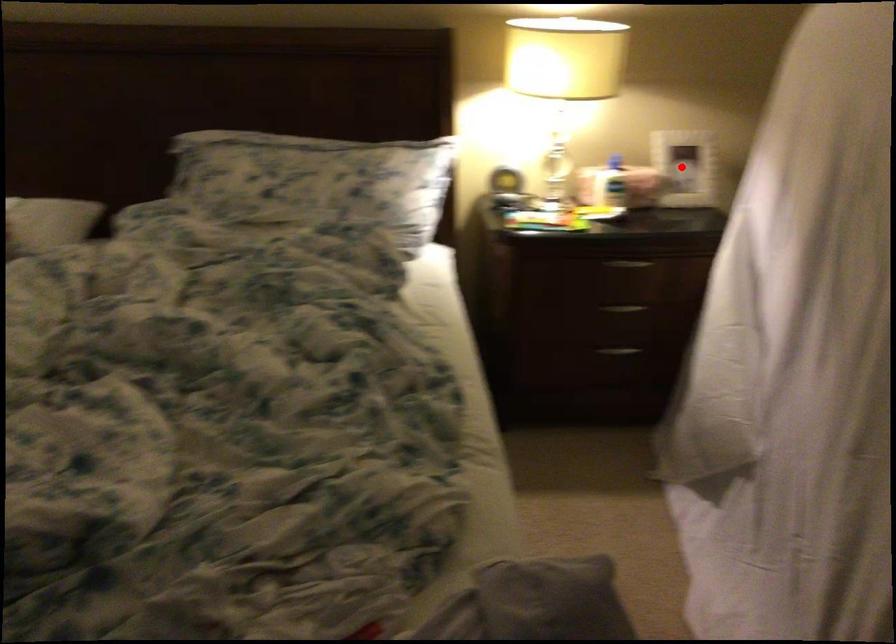
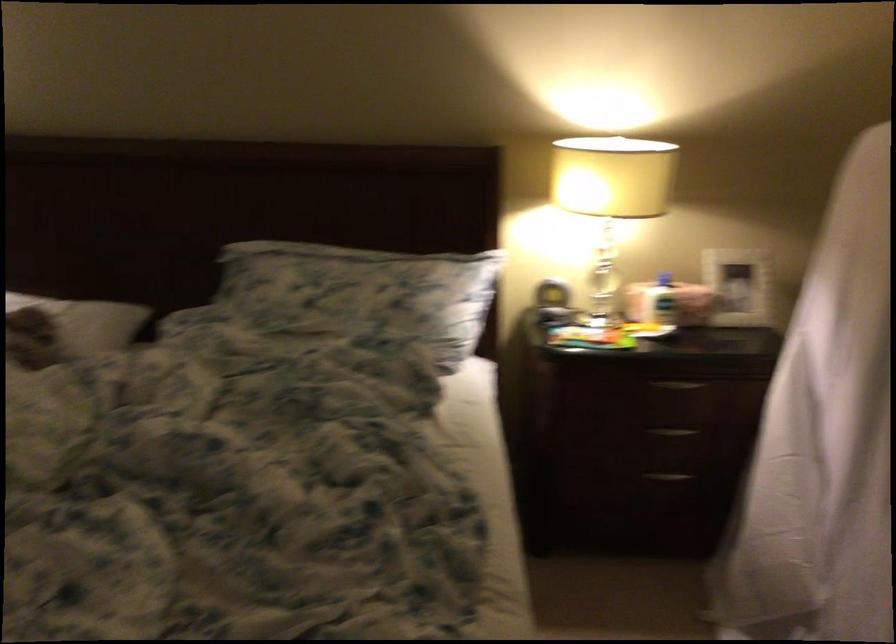
The point at the highlighted location is marked in the first image. Where is the corresponding point in the second image?

(737, 286)